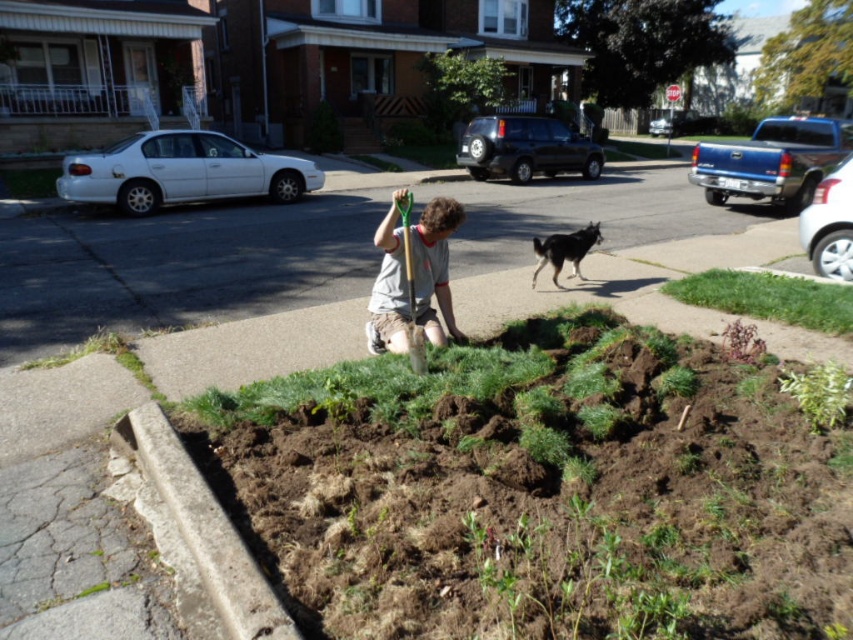
Based on the photo, you are a gardener who wants to plant a new tree in the garden bed. The tree requires a space of 1 meter in diameter. Considering the green leafy plant at lower right and the black fur dog at center, which object might be an obstacle due to its size and location?

The green leafy plant at lower right has a smaller size compared to the black fur dog at center. However, the black fur dog at center is located in the midground on the sidewalk, away from the garden bed, so it is not an obstacle. The green leafy plant at lower right is in the garden bed but is small, so it might not obstruct the tree planting. However, the question mentions the tree requires 1 meter diameter, so the plant may be too close if it is within that space. But according to the description, thedog

Based on the scene description, where is the smooth asphalt sidewalk at center positioned in relation to the other elements?

The smooth asphalt sidewalk at center is located at point coordinates of (178, 266).

You are standing at the camera position and see two points in the scene. Which point, point (802, 387) or point (548, 244), is closer to you?

Point (802, 387) is closer to the camera than point (548, 244), so the point closer to you is point (802, 387).